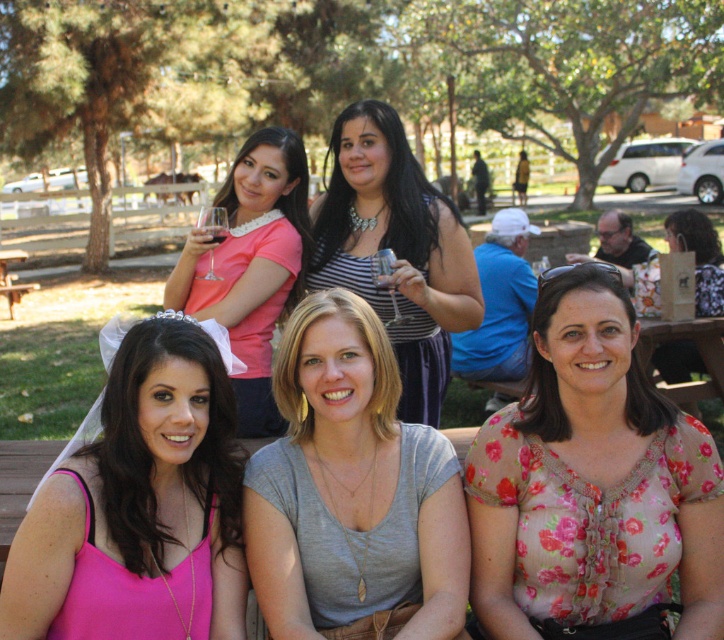
You are standing at the center of the park and see the image. There is a floral sheer blouse at lower right. Where exactly is the floral sheer blouse located in relation to the point marked at coordinates point (592, 481)?

The floral sheer blouse at lower right is located at the point marked at coordinates point (592, 481).

You are a photographer planning to take a group photo of the two women wearing the pink satin dress at lower left and the gray cotton shirt at center. Since you want them to appear balanced in the frame, which clothing item should you place closer to the camera to compensate for their size difference?

The pink satin dress at lower left has a smaller size compared to the gray cotton shirt at center. To balance their sizes in the photo, the pink satin dress at lower left should be placed closer to the camera to make it appear larger in the frame, while the gray cotton shirt at center can be positioned slightly farther away to reduce its prominence.

You are standing in front of the wooden bench where the four women are sitting. You want to place a small gift on the bench between the two points marked as point (467, 497) and point (156, 445). Which point should you aim for to ensure the gift is closer to the camera?

You should aim for point (467, 497) because it is further to the camera than point (156, 445).